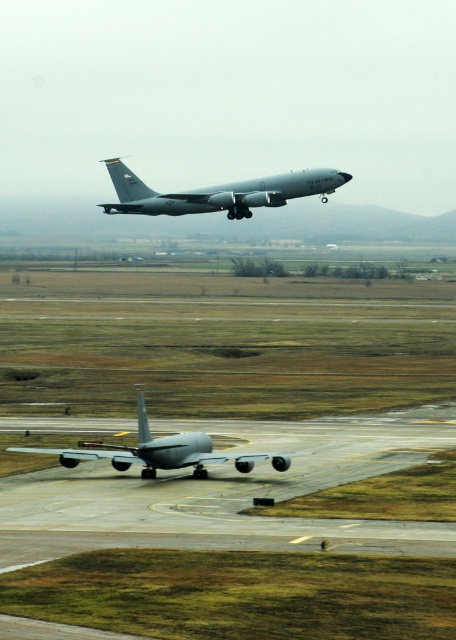
Question: Is matte gray airplane at upper center to the right of matte gray airplane at lower center from the viewer's perspective?

Choices:
 (A) yes
 (B) no

Answer: (A)

Question: Can you confirm if matte gray airplane at upper center is positioned above matte gray airplane at lower center?

Choices:
 (A) no
 (B) yes

Answer: (B)

Question: Considering the relative positions of matte gray airplane at upper center and matte gray airplane at lower center in the image provided, where is matte gray airplane at upper center located with respect to matte gray airplane at lower center?

Choices:
 (A) right
 (B) left

Answer: (A)

Question: Which point appears farthest from the camera in this image?

Choices:
 (A) (279, 179)
 (B) (278, 465)

Answer: (A)